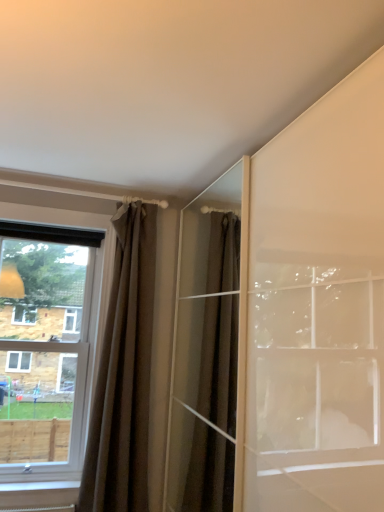
Question: Can you confirm if clear glass window at left is thinner than brown fabric curtain at left?

Choices:
 (A) no
 (B) yes

Answer: (A)

Question: Is the position of clear glass window at left more distant than that of brown fabric curtain at left?

Choices:
 (A) no
 (B) yes

Answer: (B)

Question: Can we say clear glass window at left lies outside brown fabric curtain at left?

Choices:
 (A) yes
 (B) no

Answer: (A)

Question: Is clear glass window at left at the right side of brown fabric curtain at left?

Choices:
 (A) no
 (B) yes

Answer: (A)

Question: Does clear glass window at left have a greater height compared to brown fabric curtain at left?

Choices:
 (A) yes
 (B) no

Answer: (B)

Question: Is clear glass window at left wider than brown fabric curtain at left?

Choices:
 (A) yes
 (B) no

Answer: (A)

Question: Does brown fabric curtain at left have a greater width compared to clear glass window at left?

Choices:
 (A) yes
 (B) no

Answer: (B)

Question: Considering the relative sizes of brown fabric curtain at left and clear glass window at left in the image provided, is brown fabric curtain at left taller than clear glass window at left?

Choices:
 (A) no
 (B) yes

Answer: (B)

Question: From the image's perspective, is brown fabric curtain at left above clear glass window at left?

Choices:
 (A) yes
 (B) no

Answer: (B)

Question: Is brown fabric curtain at left facing away from clear glass window at left?

Choices:
 (A) yes
 (B) no

Answer: (B)

Question: Does brown fabric curtain at left have a lesser width compared to clear glass window at left?

Choices:
 (A) yes
 (B) no

Answer: (A)

Question: Is brown fabric curtain at left in front of clear glass window at left?

Choices:
 (A) no
 (B) yes

Answer: (B)

Question: Is clear glass window at left taller or shorter than brown fabric curtain at left?

Choices:
 (A) tall
 (B) short

Answer: (B)